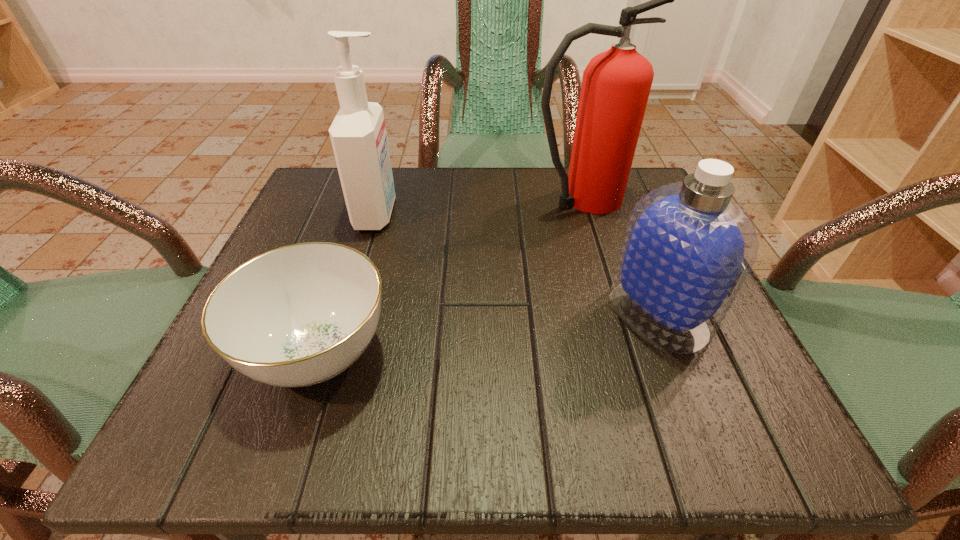
Find the location of a particular element. empty space that is in between the fire extinguisher and the shortest object is located at coordinates (448, 276).

You are a GUI agent. You are given a task and a screenshot of the screen. Output one action in this format:
    pyautogui.click(x=<x>, y=<y>)
    Task: Click on the free space between the farther cleansing agent and the fire extinguisher
    Image resolution: width=960 pixels, height=540 pixels.
    Given the screenshot: What is the action you would take?
    pyautogui.click(x=478, y=206)

Identify the location of unoccupied position between the shorter cleansing agent and the shortest object. This screenshot has width=960, height=540. (488, 334).

At what (x,y) coordinates should I click in order to perform the action: click on free spot between the shortest object and the nearer cleansing agent. Please return your answer as a coordinate pair (x, y). This screenshot has width=960, height=540. Looking at the image, I should click on pos(488,334).

Where is `object that is the closest to the fire extinguisher`? The image size is (960, 540). object that is the closest to the fire extinguisher is located at coordinates (688, 248).

What are the coordinates of `object that is the closest to the taller cleansing agent` in the screenshot? It's located at (299, 315).

This screenshot has width=960, height=540. Identify the location of vacant space that satisfies the following two spatial constraints: 1. on the front label of the right cleansing agent; 2. on the left side of the left cleansing agent. (348, 314).

Locate an element on the screen. The height and width of the screenshot is (540, 960). vacant region that satisfies the following two spatial constraints: 1. on the handle side of the fire extinguisher; 2. on the right side of the shorter cleansing agent is located at coordinates (613, 314).

This screenshot has width=960, height=540. I want to click on vacant space that satisfies the following two spatial constraints: 1. on the front label of the third tallest object; 2. on the left side of the taller cleansing agent, so click(x=348, y=314).

I want to click on vacant position in the image that satisfies the following two spatial constraints: 1. on the back side of the shorter cleansing agent; 2. on the front label of the taller cleansing agent, so click(x=618, y=214).